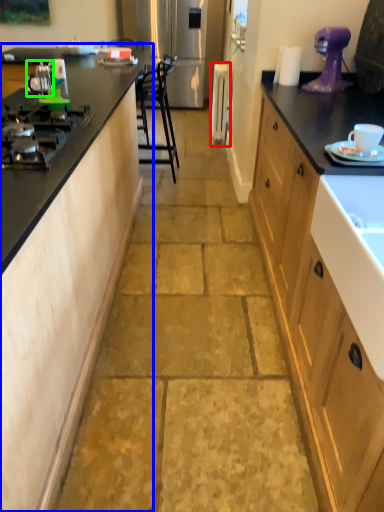
Question: Which object is the farthest from appliance (highlighted by a red box)? Choose among these: cabinetry (highlighted by a blue box) or appliance (highlighted by a green box).

Choices:
 (A) cabinetry
 (B) appliance

Answer: (A)